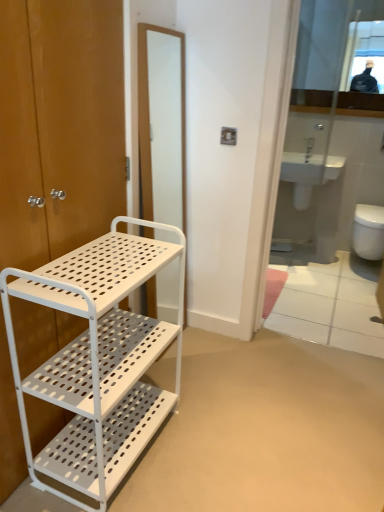
Identify the location of empty space that is to the right of matte wood door at left. (231, 422).